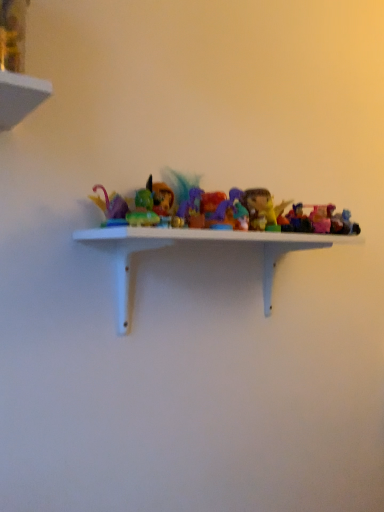
The width and height of the screenshot is (384, 512). In order to click on matte green toy at center, positioned as the 6th toy in right-to-left order in this screenshot , I will do `click(143, 210)`.

Measure the distance between translucent plastic toy at center, which appears as the fourth toy when viewed from the left, and camera.

translucent plastic toy at center, which appears as the fourth toy when viewed from the left, and camera are 31.14 inches apart.

This screenshot has height=512, width=384. What do you see at coordinates (231, 212) in the screenshot?
I see `translucent purple figurine at center, placed as the fifth toy when sorted from right to left` at bounding box center [231, 212].

What do you see at coordinates (262, 209) in the screenshot?
I see `translucent plastic figurine at center, the 4th toy viewed from the right` at bounding box center [262, 209].

Locate an element on the screen. translucent plastic figurine at center, the 3th toy when ordered from left to right is located at coordinates (262, 209).

What do you see at coordinates (321, 218) in the screenshot? This screenshot has height=512, width=384. I see `translucent plastic toy at center, which appears as the 2th toy when viewed from the right` at bounding box center [321, 218].

The width and height of the screenshot is (384, 512). Find the location of `white matte shelf at center`. white matte shelf at center is located at coordinates (199, 240).

Where is `shelf below the translucent plastic toy at center, which appears as the 2th toy when viewed from the right (from the image's perspective)`? This screenshot has width=384, height=512. shelf below the translucent plastic toy at center, which appears as the 2th toy when viewed from the right (from the image's perspective) is located at coordinates (199, 240).

Are translucent plastic toy at center, which appears as the 2th toy when viewed from the right, and white matte shelf at center far apart?

No, translucent plastic toy at center, which appears as the 2th toy when viewed from the right, is not far from white matte shelf at center.

Can you confirm if translucent plastic toy at center, which ranks as the 5th toy in left-to-right order, is thinner than white matte shelf at center?

Yes, translucent plastic toy at center, which ranks as the 5th toy in left-to-right order, is thinner than white matte shelf at center.

From the image's perspective, is translucent plastic toy at center, which appears as the 2th toy when viewed from the right, over white matte shelf at center?

Yes.

Which object is further away from the camera taking this photo, pink plastic toy at right, the first toy when ordered from right to left, or matte green toy at center, positioned as the 6th toy in right-to-left order?

pink plastic toy at right, the first toy when ordered from right to left, is further from the camera.

Considering the positions of points (349, 212) and (128, 218), is point (349, 212) closer to camera compared to point (128, 218)?

No, (349, 212) is behind (128, 218).

Is pink plastic toy at right, the first toy when ordered from right to left, not close to matte green toy at center, positioned as the 6th toy in right-to-left order?

No, pink plastic toy at right, the first toy when ordered from right to left, is in close proximity to matte green toy at center, positioned as the 6th toy in right-to-left order.

Is translucent plastic toy at center, which appears as the fourth toy when viewed from the left, in front of or behind translucent purple figurine at center, placed as the fifth toy when sorted from right to left, in the image?

Visually, translucent plastic toy at center, which appears as the fourth toy when viewed from the left, is located behind translucent purple figurine at center, placed as the fifth toy when sorted from right to left.

How different are the orientations of translucent plastic toy at center, which appears as the fourth toy when viewed from the left, and translucent purple figurine at center, which is counted as the second toy, starting from the left, in degrees?

They differ by 0.0109 degrees in their facing directions.

From the image's perspective, between translucent plastic toy at center, marked as the 3th toy in a right-to-left arrangement, and translucent purple figurine at center, placed as the fifth toy when sorted from right to left, which one is located above?

translucent purple figurine at center, placed as the fifth toy when sorted from right to left, from the image's perspective.

Is translucent plastic toy at center, which appears as the fourth toy when viewed from the left, oriented towards translucent purple figurine at center, which is counted as the second toy, starting from the left?

No, translucent plastic toy at center, which appears as the fourth toy when viewed from the left, does not turn towards translucent purple figurine at center, which is counted as the second toy, starting from the left.

Where is `shelf that appears in front of the pink plastic toy at right, which appears as the sixth toy when viewed from the left`? This screenshot has height=512, width=384. shelf that appears in front of the pink plastic toy at right, which appears as the sixth toy when viewed from the left is located at coordinates (199, 240).

Between white matte shelf at center and pink plastic toy at right, the first toy when ordered from right to left, which one has less height?

pink plastic toy at right, the first toy when ordered from right to left, is shorter.

Is white matte shelf at center in front of or behind pink plastic toy at right, the first toy when ordered from right to left, in the image?

Visually, white matte shelf at center is located in front of pink plastic toy at right, the first toy when ordered from right to left.

Which of these two, white matte shelf at center or pink plastic toy at right, the first toy when ordered from right to left, is thinner?

Thinner between the two is pink plastic toy at right, the first toy when ordered from right to left.

Is translucent purple figurine at center, placed as the fifth toy when sorted from right to left, smaller than translucent plastic figurine at center, the 3th toy when ordered from left to right?

Yes.

From a real-world perspective, starting from the translucent plastic figurine at center, the 3th toy when ordered from left to right, which toy is the 1st one below it? Please provide its 2D coordinates.

[(231, 212)]

Is translucent purple figurine at center, which is counted as the second toy, starting from the left, in front of or behind translucent plastic figurine at center, the 4th toy viewed from the right, in the image?

Visually, translucent purple figurine at center, which is counted as the second toy, starting from the left, is located in front of translucent plastic figurine at center, the 4th toy viewed from the right.

Considering the sizes of objects translucent purple figurine at center, placed as the fifth toy when sorted from right to left, and translucent plastic figurine at center, the 4th toy viewed from the right, in the image provided, who is wider, translucent purple figurine at center, placed as the fifth toy when sorted from right to left, or translucent plastic figurine at center, the 4th toy viewed from the right,?

With larger width is translucent plastic figurine at center, the 4th toy viewed from the right.

Is matte green toy at center, which is the 1th toy from left to right, taller or shorter than translucent plastic toy at center, which appears as the fourth toy when viewed from the left?

In the image, matte green toy at center, which is the 1th toy from left to right, appears to be shorter than translucent plastic toy at center, which appears as the fourth toy when viewed from the left.

Is matte green toy at center, which is the 1th toy from left to right, next to translucent plastic toy at center, which appears as the fourth toy when viewed from the left, and touching it?

They are not placed beside each other.

Is matte green toy at center, positioned as the 6th toy in right-to-left order, completely or partially outside of translucent plastic toy at center, marked as the 3th toy in a right-to-left arrangement?

Yes.

Would you say matte green toy at center, which is the 1th toy from left to right, is to the left or to the right of translucent plastic toy at center, marked as the 3th toy in a right-to-left arrangement, in the picture?

From the image, it's evident that matte green toy at center, which is the 1th toy from left to right, is to the left of translucent plastic toy at center, marked as the 3th toy in a right-to-left arrangement.

From a real-world perspective, who is located lower, translucent purple figurine at center, which is counted as the second toy, starting from the left, or translucent plastic toy at center, which appears as the fourth toy when viewed from the left?

From a 3D spatial view, translucent plastic toy at center, which appears as the fourth toy when viewed from the left, is below.

Is translucent purple figurine at center, placed as the fifth toy when sorted from right to left, positioned far away from translucent plastic toy at center, which appears as the fourth toy when viewed from the left?

translucent purple figurine at center, placed as the fifth toy when sorted from right to left, is near translucent plastic toy at center, which appears as the fourth toy when viewed from the left, not far away.

In terms of height, does translucent purple figurine at center, which is counted as the second toy, starting from the left, look taller or shorter compared to translucent plastic toy at center, marked as the 3th toy in a right-to-left arrangement?

In the image, translucent purple figurine at center, which is counted as the second toy, starting from the left, appears to be taller than translucent plastic toy at center, marked as the 3th toy in a right-to-left arrangement.

From the image's perspective, is translucent purple figurine at center, which is counted as the second toy, starting from the left, located above or below translucent plastic toy at center, marked as the 3th toy in a right-to-left arrangement?

translucent purple figurine at center, which is counted as the second toy, starting from the left, is above translucent plastic toy at center, marked as the 3th toy in a right-to-left arrangement.

I want to click on the 5th toy behind the white matte shelf at center, starting your count from the anchor, so click(321, 218).

This screenshot has height=512, width=384. I want to click on the 1st toy above when counting from the matte green toy at center, positioned as the 6th toy in right-to-left order (from the image's perspective), so click(x=344, y=224).

Which object lies further to the anchor point translucent plastic figurine at center, the 4th toy viewed from the right, matte green toy at center, which is the 1th toy from left to right, or translucent purple figurine at center, which is counted as the second toy, starting from the left?

matte green toy at center, which is the 1th toy from left to right.

Considering their positions, is pink plastic toy at right, which appears as the sixth toy when viewed from the left, positioned further to translucent plastic toy at center, which appears as the fourth toy when viewed from the left, than translucent plastic toy at center, which ranks as the 5th toy in left-to-right order?

pink plastic toy at right, which appears as the sixth toy when viewed from the left, is positioned further to the anchor translucent plastic toy at center, which appears as the fourth toy when viewed from the left.

Which object lies further to the anchor point translucent plastic toy at center, which ranks as the 5th toy in left-to-right order, translucent plastic toy at center, which appears as the fourth toy when viewed from the left, or translucent plastic figurine at center, the 3th toy when ordered from left to right?

Based on the image, translucent plastic figurine at center, the 3th toy when ordered from left to right, appears to be further to translucent plastic toy at center, which ranks as the 5th toy in left-to-right order.

Looking at the image, which one is located closer to matte green toy at center, positioned as the 6th toy in right-to-left order, translucent plastic toy at center, which appears as the fourth toy when viewed from the left, or translucent plastic toy at center, which ranks as the 5th toy in left-to-right order?

translucent plastic toy at center, which appears as the fourth toy when viewed from the left.

Which object lies nearer to the anchor point pink plastic toy at right, the first toy when ordered from right to left, translucent plastic toy at center, marked as the 3th toy in a right-to-left arrangement, or matte green toy at center, positioned as the 6th toy in right-to-left order?

translucent plastic toy at center, marked as the 3th toy in a right-to-left arrangement, is closer to pink plastic toy at right, the first toy when ordered from right to left.

Considering their positions, is pink plastic toy at right, which appears as the sixth toy when viewed from the left, positioned closer to white matte shelf at center than matte green toy at center, positioned as the 6th toy in right-to-left order?

Among the two, matte green toy at center, positioned as the 6th toy in right-to-left order, is located nearer to white matte shelf at center.

Looking at the image, which one is located closer to translucent purple figurine at center, placed as the fifth toy when sorted from right to left, translucent plastic figurine at center, the 4th toy viewed from the right, or translucent plastic toy at center, which ranks as the 5th toy in left-to-right order?

Among the two, translucent plastic figurine at center, the 4th toy viewed from the right, is located nearer to translucent purple figurine at center, placed as the fifth toy when sorted from right to left.

Based on their spatial positions, is translucent plastic figurine at center, the 4th toy viewed from the right, or translucent plastic toy at center, which appears as the 2th toy when viewed from the right, closer to matte green toy at center, positioned as the 6th toy in right-to-left order?

translucent plastic figurine at center, the 4th toy viewed from the right, lies closer to matte green toy at center, positioned as the 6th toy in right-to-left order, than the other object.

Locate an element on the screen. Image resolution: width=384 pixels, height=512 pixels. shelf situated between matte green toy at center, positioned as the 6th toy in right-to-left order, and translucent plastic figurine at center, the 3th toy when ordered from left to right, from left to right is located at coordinates (199, 240).

What are the coordinates of `shelf between matte green toy at center, positioned as the 6th toy in right-to-left order, and pink plastic toy at right, the first toy when ordered from right to left, in the horizontal direction` in the screenshot? It's located at (199, 240).

You are a GUI agent. You are given a task and a screenshot of the screen. Output one action in this format:
    pyautogui.click(x=<x>, y=<y>)
    Task: Click on the toy situated between translucent plastic figurine at center, the 4th toy viewed from the right, and translucent plastic toy at center, which ranks as the 5th toy in left-to-right order, from left to right
    This screenshot has height=512, width=384.
    Given the screenshot: What is the action you would take?
    pyautogui.click(x=296, y=220)

Where is `toy situated between matte green toy at center, which is the 1th toy from left to right, and white matte shelf at center from left to right`? toy situated between matte green toy at center, which is the 1th toy from left to right, and white matte shelf at center from left to right is located at coordinates (231, 212).